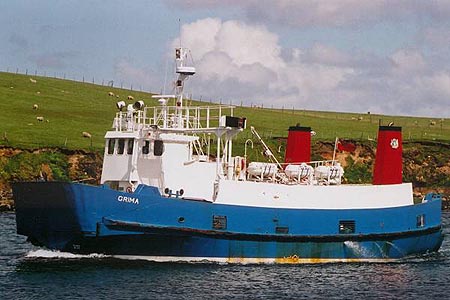
Find the location of a particular element. This screenshot has height=300, width=450. windows is located at coordinates (157, 147), (145, 147), (132, 147), (118, 147), (111, 147).